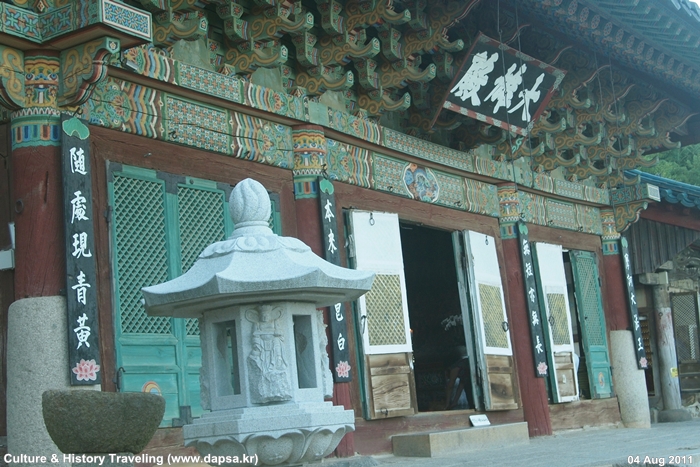
Identify the location of doorway. (416, 244), (449, 245), (460, 390), (435, 390).